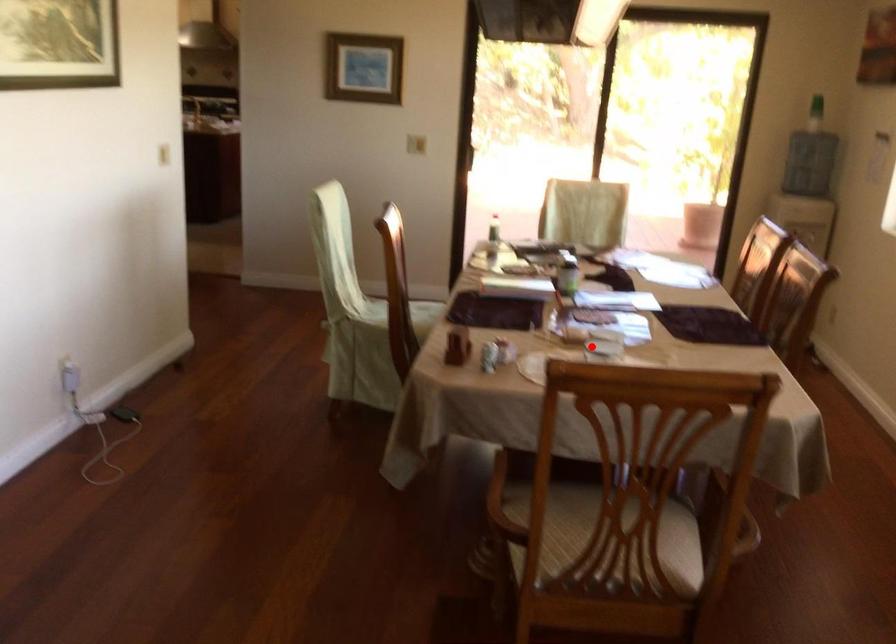
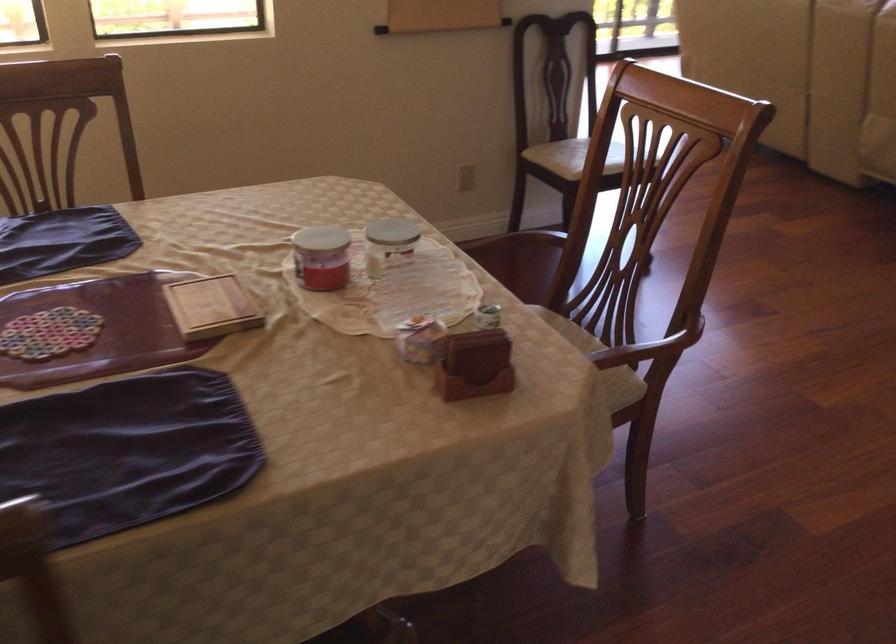
Locate, in the second image, the point that corresponds to the highlighted location in the first image.

(389, 243)